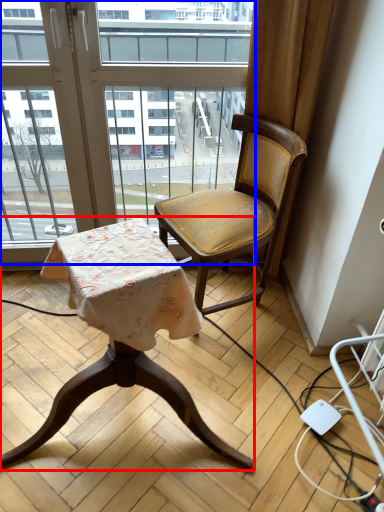
Question: Among these objects, which one is farthest to the camera, chair (highlighted by a red box) or window (highlighted by a blue box)?

Choices:
 (A) chair
 (B) window

Answer: (B)